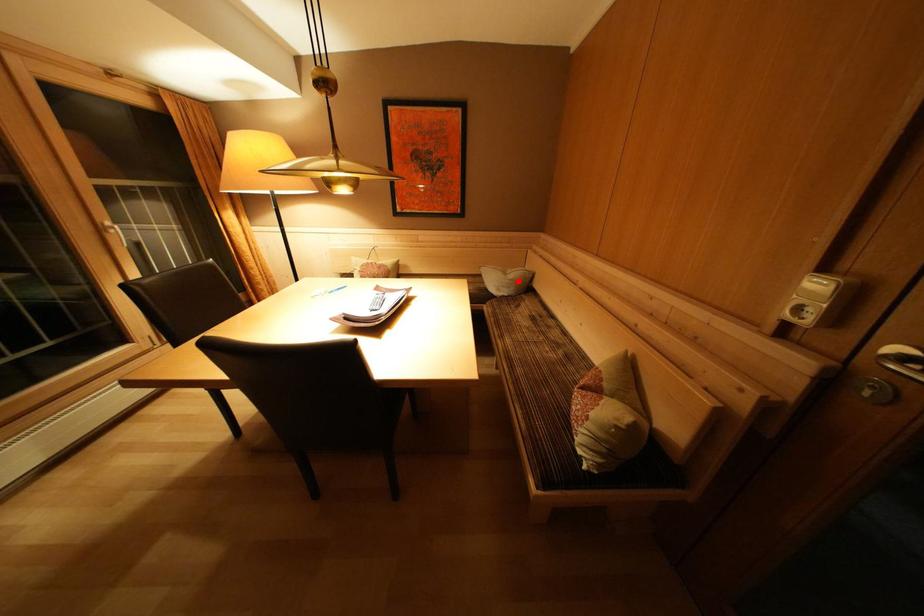
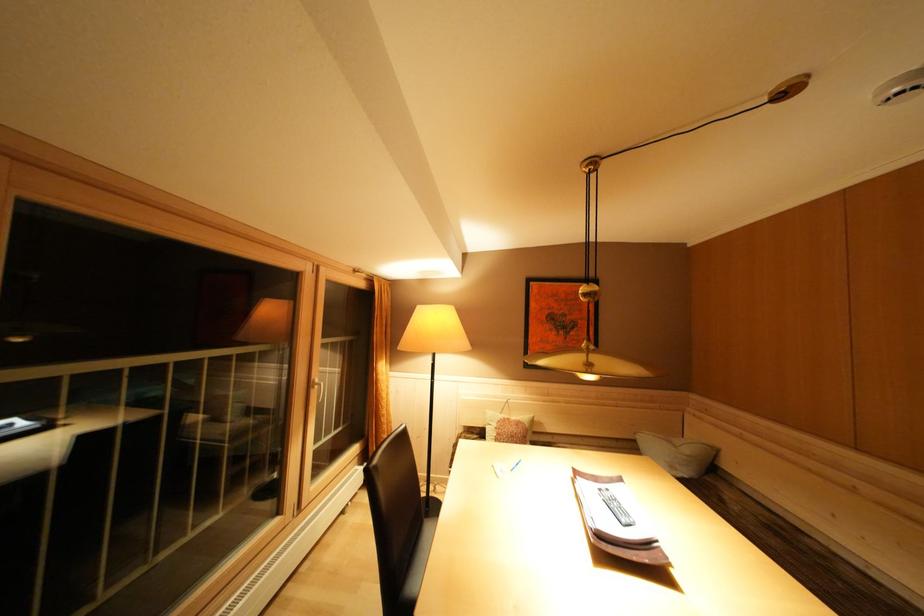
Question: A red point is marked in image1. In image2, is the corresponding 3D point closer to the camera or farther? Reply with the corresponding letter.

Choices:
 (A) The corresponding 3D point is closer.
 (B) The corresponding 3D point is farther.

Answer: (B)